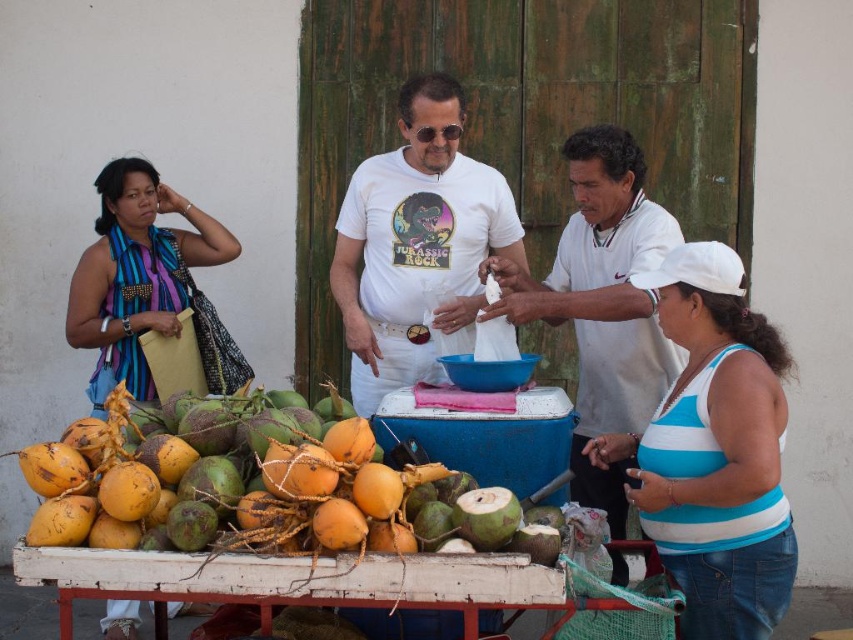
Question: Does white wooden table at lower center have a lesser width compared to green coconut at center?

Choices:
 (A) yes
 (B) no

Answer: (B)

Question: Which of the following is the closest to the observer?

Choices:
 (A) white wooden table at lower center
 (B) green coconut at center
 (C) white fabric cap at upper right

Answer: (A)

Question: Which point is farther from the camera taking this photo?

Choices:
 (A) (207, 588)
 (B) (426, 472)
 (C) (625, 372)
 (D) (726, 458)

Answer: (C)

Question: Can you confirm if ripe yellow coconuts at lower left is positioned to the right of white wooden table at lower center?

Choices:
 (A) yes
 (B) no

Answer: (A)

Question: Can you confirm if white fabric cap at upper right is positioned to the right of white wooden table at lower center?

Choices:
 (A) no
 (B) yes

Answer: (B)

Question: Considering the real-world distances, which object is farthest from the white matte t-shirt at center?

Choices:
 (A) white fabric cap at upper right
 (B) blue striped scarf at left
 (C) white wooden table at lower center

Answer: (C)